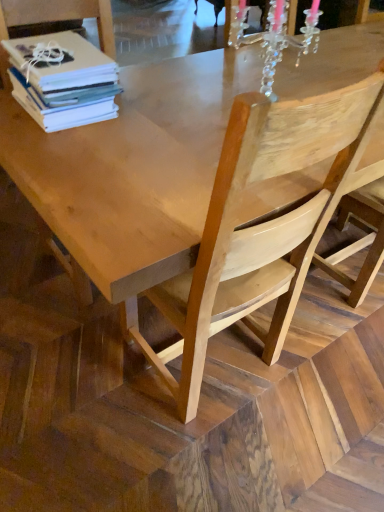
In order to click on free space to the left of clear crystal chandelier at upper center in this screenshot , I will do `click(200, 99)`.